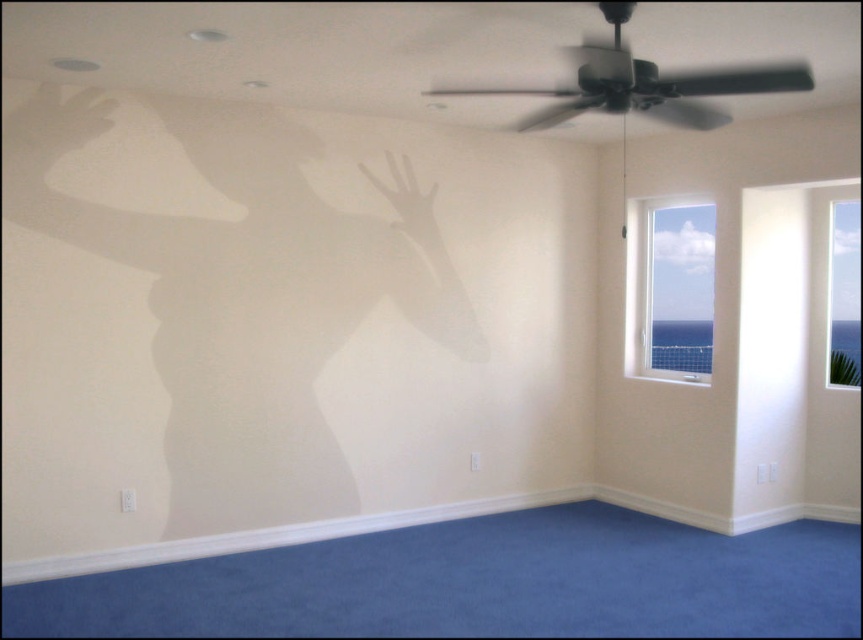
Question: Which of the following is the closest to the observer?

Choices:
 (A) transparent glass window at right
 (B) transparent glass window at upper right
 (C) matte white hand at upper left

Answer: (C)

Question: Is transparent glass window at upper right closer to camera compared to transparent glass window at right?

Choices:
 (A) no
 (B) yes

Answer: (A)

Question: Among these points, which one is farthest from the camera?

Choices:
 (A) (401, 173)
 (B) (93, 104)

Answer: (A)

Question: Which of the following is the farthest from the observer?

Choices:
 (A) (650, 289)
 (B) (74, 116)
 (C) (20, 129)
 (D) (392, 205)

Answer: (A)

Question: Is transparent plastic hand at upper left thinner than matte white hand at upper left?

Choices:
 (A) no
 (B) yes

Answer: (A)

Question: Is transparent glass window at upper right above transparent plastic hand at upper left?

Choices:
 (A) no
 (B) yes

Answer: (A)